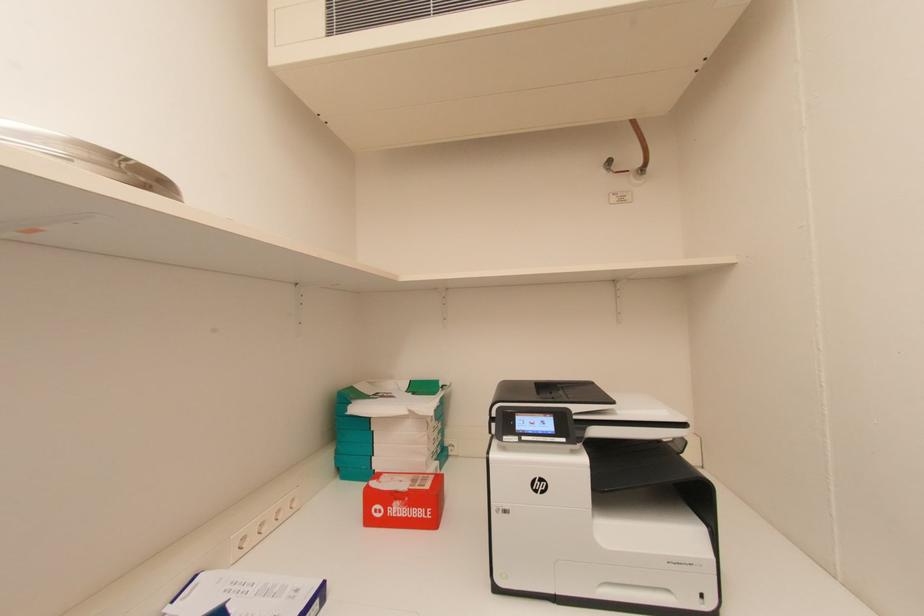
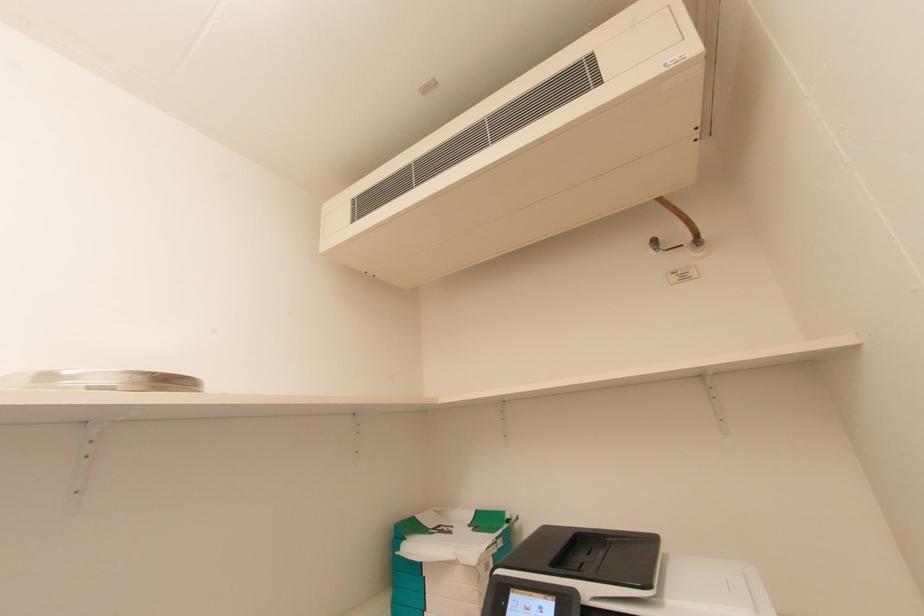
The images are taken continuously from a first-person perspective. In which direction is your viewpoint rotating?

The rotation direction of the camera is left-up.